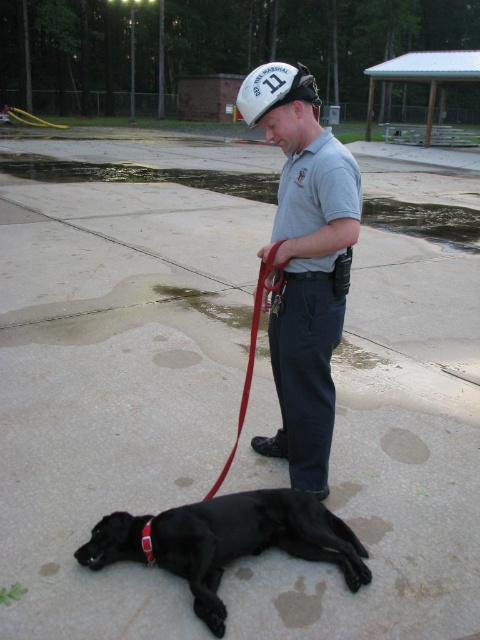
What do you see at coordinates (304, 262) in the screenshot?
I see `gray matte uniform at center` at bounding box center [304, 262].

Can you confirm if gray matte uniform at center is positioned to the right of white matte baseball cap at center?

Correct, you'll find gray matte uniform at center to the right of white matte baseball cap at center.

Measure the distance between gray matte uniform at center and camera.

gray matte uniform at center and camera are 7.42 feet apart from each other.

Image resolution: width=480 pixels, height=640 pixels. I want to click on gray matte uniform at center, so click(x=304, y=262).

Does point (297, 509) lie in front of point (262, 282)?

That is True.

How much distance is there between black smooth dog at lower center and red leather leash at center?

They are 43.41 centimeters apart.

Who is more forward, (297, 518) or (252, 369)?

Positioned in front is point (297, 518).

You are a GUI agent. You are given a task and a screenshot of the screen. Output one action in this format:
    pyautogui.click(x=<x>, y=<y>)
    Task: Click on the black smooth dog at lower center
    The image size is (480, 640).
    Given the screenshot: What is the action you would take?
    pyautogui.click(x=227, y=541)

Between point (268, 68) and point (252, 324), which one is positioned in front?

Point (268, 68)

Which is above, white matte baseball cap at center or red leather leash at center?

white matte baseball cap at center is higher up.

Find the location of `white matte baseball cap at center`. white matte baseball cap at center is located at coordinates (275, 90).

At what (x,y) coordinates should I click in order to perform the action: click on white matte baseball cap at center. Please return your answer as a coordinate pair (x, y). Image resolution: width=480 pixels, height=640 pixels. Looking at the image, I should click on (275, 90).